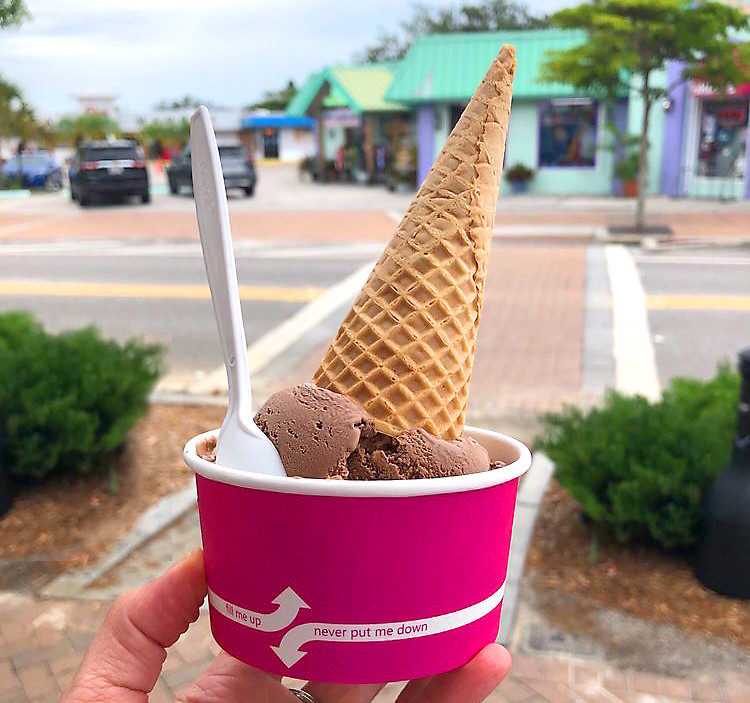
At what (x,y) coordinates should I click in order to perform the action: click on spoon. Please return your answer as a coordinate pair (x, y). This screenshot has height=703, width=750. Looking at the image, I should click on (246, 449).